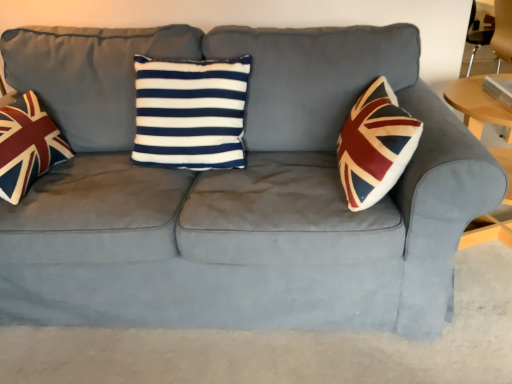
Question: Is wooden round table at right positioned far away from navy blue/white striped cushion at center?

Choices:
 (A) no
 (B) yes

Answer: (A)

Question: From the image's perspective, would you say wooden round table at right is positioned over navy blue/white striped cushion at center?

Choices:
 (A) no
 (B) yes

Answer: (A)

Question: Can you confirm if wooden round table at right is positioned to the left of navy blue/white striped cushion at center?

Choices:
 (A) no
 (B) yes

Answer: (A)

Question: Is wooden round table at right with navy blue/white striped cushion at center?

Choices:
 (A) no
 (B) yes

Answer: (A)

Question: Considering the relative sizes of wooden round table at right and navy blue/white striped cushion at center in the image provided, is wooden round table at right wider than navy blue/white striped cushion at center?

Choices:
 (A) no
 (B) yes

Answer: (B)

Question: Is wooden round table at right shorter than navy blue/white striped cushion at center?

Choices:
 (A) no
 (B) yes

Answer: (A)

Question: Are union jack fabric pillow at left and wooden round table at right located far from each other?

Choices:
 (A) no
 (B) yes

Answer: (B)

Question: From a real-world perspective, does union jack fabric pillow at left sit lower than wooden round table at right?

Choices:
 (A) no
 (B) yes

Answer: (A)

Question: Could you tell me if union jack fabric pillow at left is facing wooden round table at right?

Choices:
 (A) yes
 (B) no

Answer: (A)

Question: Can you confirm if union jack fabric pillow at left is thinner than wooden round table at right?

Choices:
 (A) no
 (B) yes

Answer: (B)

Question: Is the depth of union jack fabric pillow at left less than that of wooden round table at right?

Choices:
 (A) no
 (B) yes

Answer: (B)

Question: Is union jack fabric pillow at left taller than wooden round table at right?

Choices:
 (A) yes
 (B) no

Answer: (B)

Question: Considering the relative sizes of navy blue/white striped cushion at center and wooden round table at right in the image provided, is navy blue/white striped cushion at center taller than wooden round table at right?

Choices:
 (A) no
 (B) yes

Answer: (A)